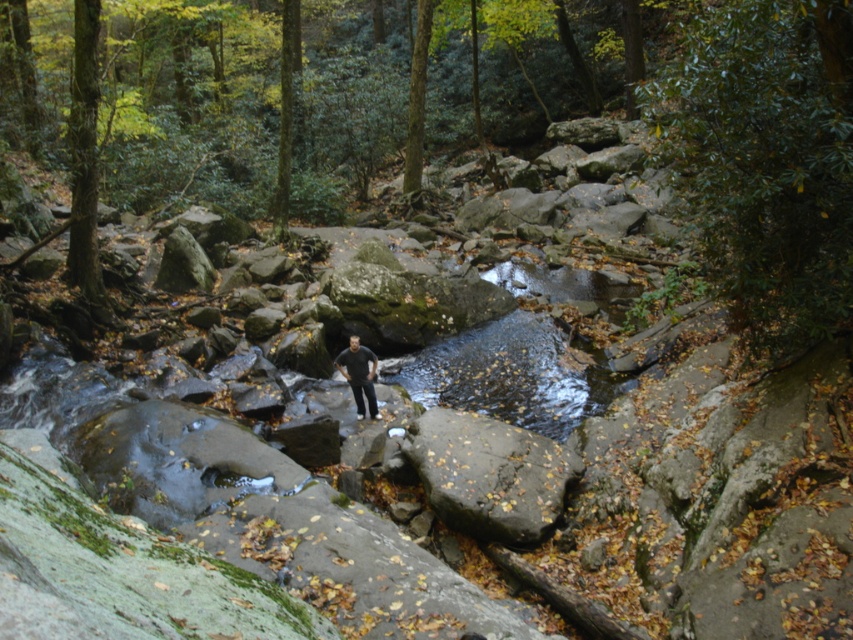
Consider the image. Does clear water at center have a greater width compared to dark gray textured rock at center?

Correct, the width of clear water at center exceeds that of dark gray textured rock at center.

Is clear water at center behind dark gray textured rock at center?

Yes, it is.

Where is `clear water at center`? The width and height of the screenshot is (853, 640). clear water at center is located at coordinates (511, 374).

Does point (606, 403) come in front of point (343, 356)?

No, (606, 403) is further to viewer.

Identify the location of clear water at center. The image size is (853, 640). (511, 374).

Who is more forward, (450, 433) or (355, 388)?

Positioned in front is point (450, 433).

What do you see at coordinates (489, 474) in the screenshot? This screenshot has width=853, height=640. I see `dark gray textured rock at center` at bounding box center [489, 474].

Where is `dark gray textured rock at center`? This screenshot has height=640, width=853. dark gray textured rock at center is located at coordinates (489, 474).